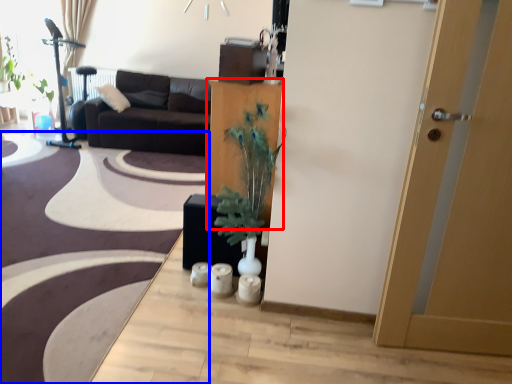
Question: Which object is further to the camera taking this photo, cabinetry (highlighted by a red box) or plain (highlighted by a blue box)?

Choices:
 (A) cabinetry
 (B) plain

Answer: (A)